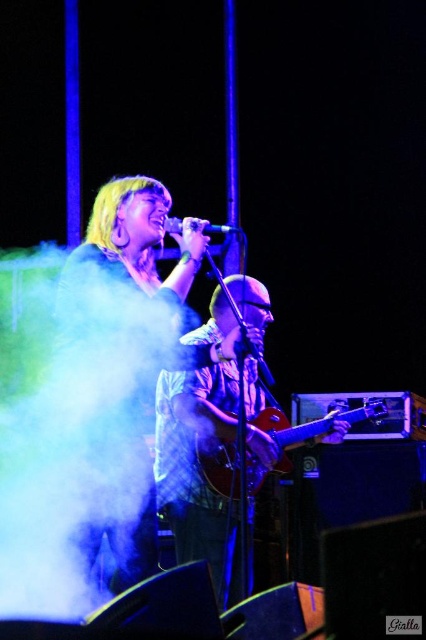
Is point (144, 305) positioned behind point (227, 228)?

No, (144, 305) is closer to viewer.

Who is lower down, white fog at center or black matte microphone at center?

white fog at center

Where is `white fog at center`? white fog at center is located at coordinates (71, 420).

Is point (232, 413) behind point (218, 227)?

Yes, point (232, 413) is behind point (218, 227).

Is glossy wood guitar at center positioned behind black matte microphone at center?

Yes, it is behind black matte microphone at center.

Is point (275, 424) positioned behind point (181, 232)?

Yes, point (275, 424) is behind point (181, 232).

Locate an element on the screen. Image resolution: width=426 pixels, height=640 pixels. glossy wood guitar at center is located at coordinates tap(310, 426).

Can you confirm if white fog at center is wider than glossy wood guitar at center?

Indeed, white fog at center has a greater width compared to glossy wood guitar at center.

From the picture: Can you confirm if white fog at center is positioned above glossy wood guitar at center?

Yes, white fog at center is above glossy wood guitar at center.

Find the location of a particular element. The width and height of the screenshot is (426, 640). white fog at center is located at coordinates (71, 420).